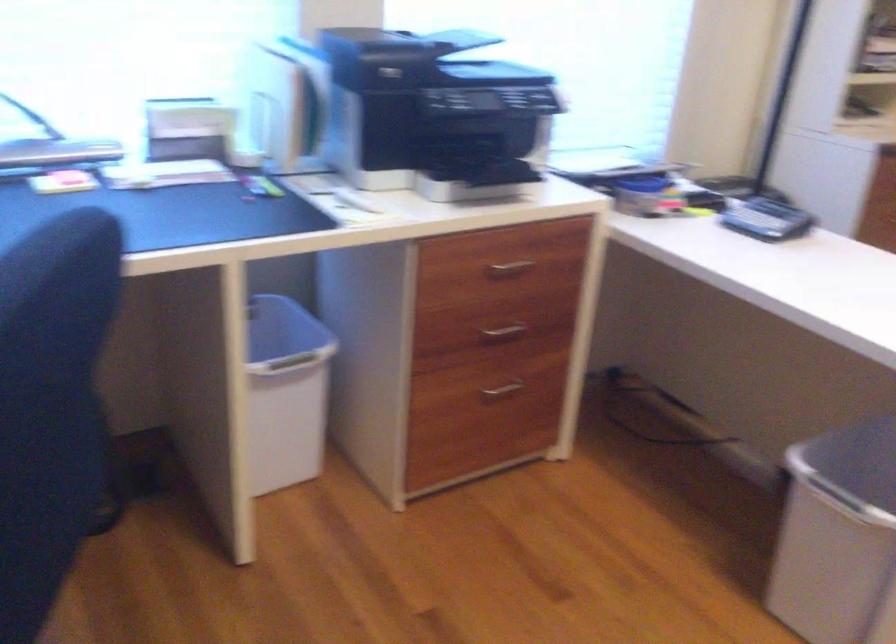
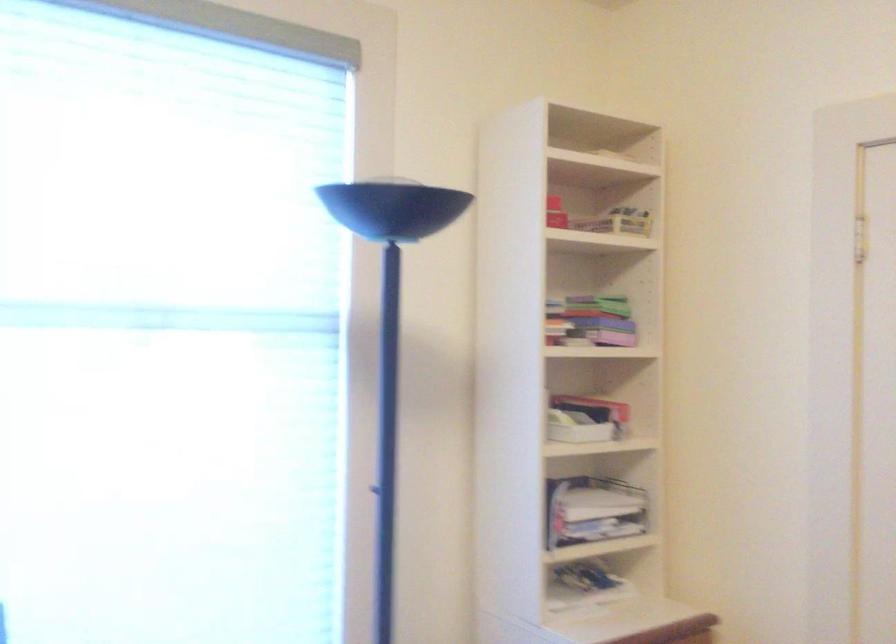
In a continuous first-person perspective shot, in which direction is the camera moving?

The movement direction of the cameraman is right, forward.